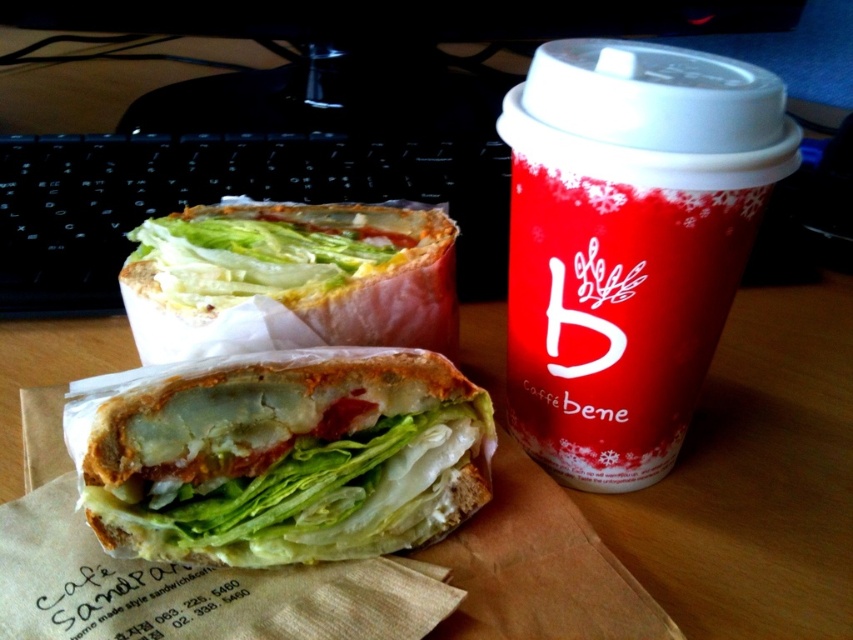
You are organizing a picnic and have a matte white sandwich at center and a matte white bread at center on your picnic blanket. Which item is located to the left of the other?

The matte white bread at center is located to the left of the matte white sandwich at center because the sandwich is on the right side of the bread.

You are a photographer taking a closeup shot of the matte white sandwich at center. You need to ensure that the sandwich is in focus while the background remains slightly blurred. Given that the camera has a depth of field setting, what is the minimum distance you should set the focus point to capture the sandwich clearly?

The matte white sandwich at center is 22.78 inches away from the camera. To ensure it is in focus while keeping the background blurred, set the focus point at approximately 22.78 inches.

You are organizing a small event and need to place a name tag at the position of the point labeled as point [628,243]. Where exactly should you place the name tag on the wooden desk?

The point [628,243] is located at the red paper cup at upper right, so you should place the name tag at the red paper cup at upper right.